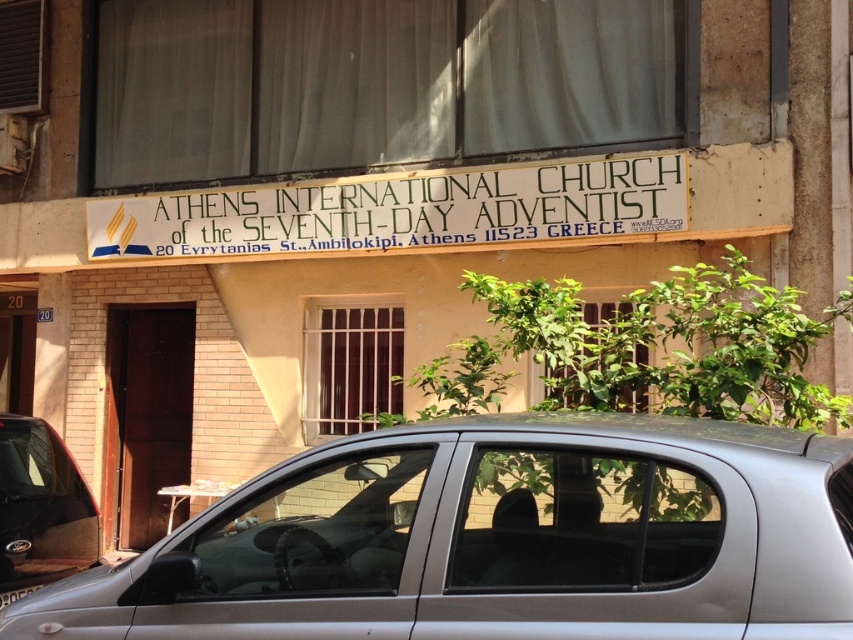
Consider the image. You are a delivery driver who needs to park your metallic gray car at lower left near the entrance of the building. However, there is a white painted wood sign at upper center in the way. Can you park your car without obstructing the sign?

The white painted wood sign at upper center is positioned on the right side of metallic gray car at lower left, so parking the metallic gray car at lower left would not obstruct the sign as it is placed to the right of the car.

In the scene shown: You are a delivery driver approaching the Athens International Church of the Seventh Day Adventist. You see a satin silver car at center and a white sheer curtain at upper center. Which object is wider?

The satin silver car at center has a lesser width compared to the white sheer curtain at upper center, so the white sheer curtain at upper center is wider.